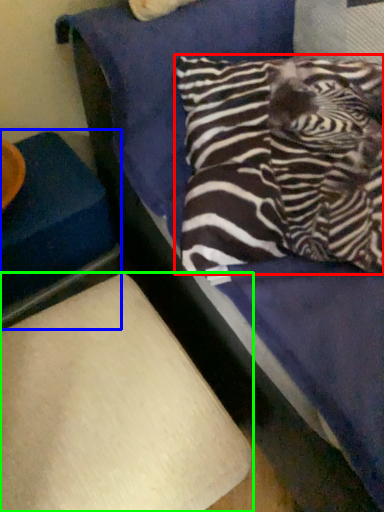
Question: Which object is positioned farthest from pillow (highlighted by a red box)? Select from furniture (highlighted by a blue box) and furniture (highlighted by a green box).

Choices:
 (A) furniture
 (B) furniture

Answer: (A)